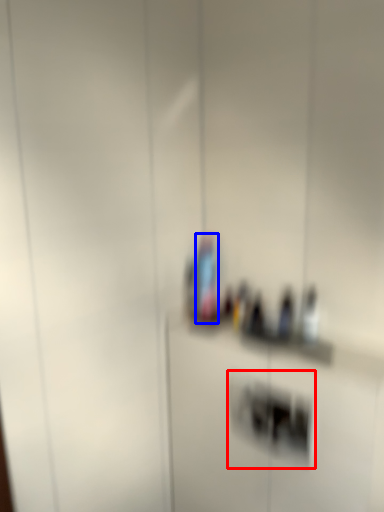
Question: Which of the following is the farthest to the observer, light switch (highlighted by a red box) or bottle (highlighted by a blue box)?

Choices:
 (A) light switch
 (B) bottle

Answer: (B)